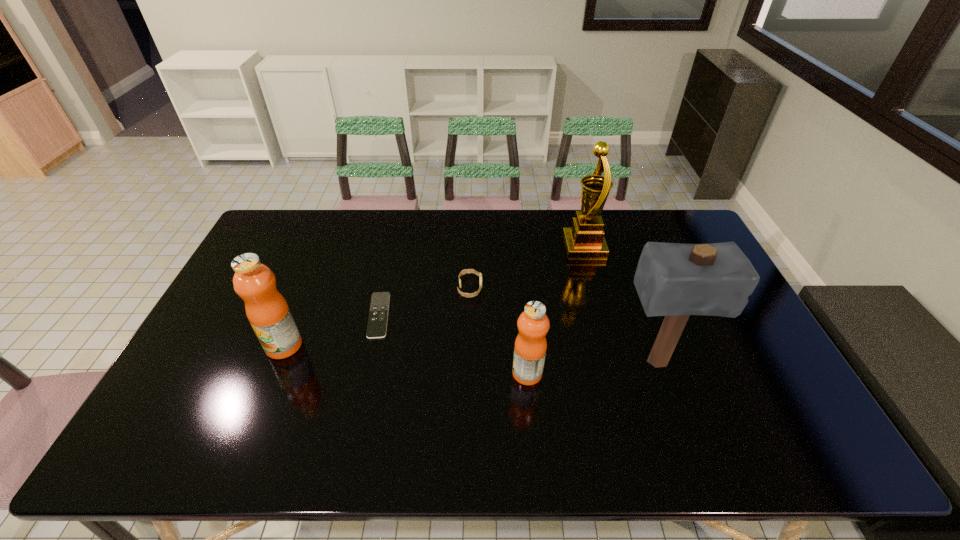
What are the coordinates of `vacant space that satisfies the following two spatial constraints: 1. on the front-facing side of the farthest object; 2. on the right side of the mallet` in the screenshot? It's located at (615, 362).

Identify the location of vacant area in the image that satisfies the following two spatial constraints: 1. on the back side of the third object from right to left; 2. on the face of the fifth tallest object. (519, 288).

Locate an element on the screen. This screenshot has width=960, height=540. free region that satisfies the following two spatial constraints: 1. on the face of the watch; 2. on the back side of the nearer fruit juice is located at coordinates (468, 373).

Locate an element on the screen. vacant space that satisfies the following two spatial constraints: 1. on the face of the watch; 2. on the left side of the shorter fruit juice is located at coordinates (468, 373).